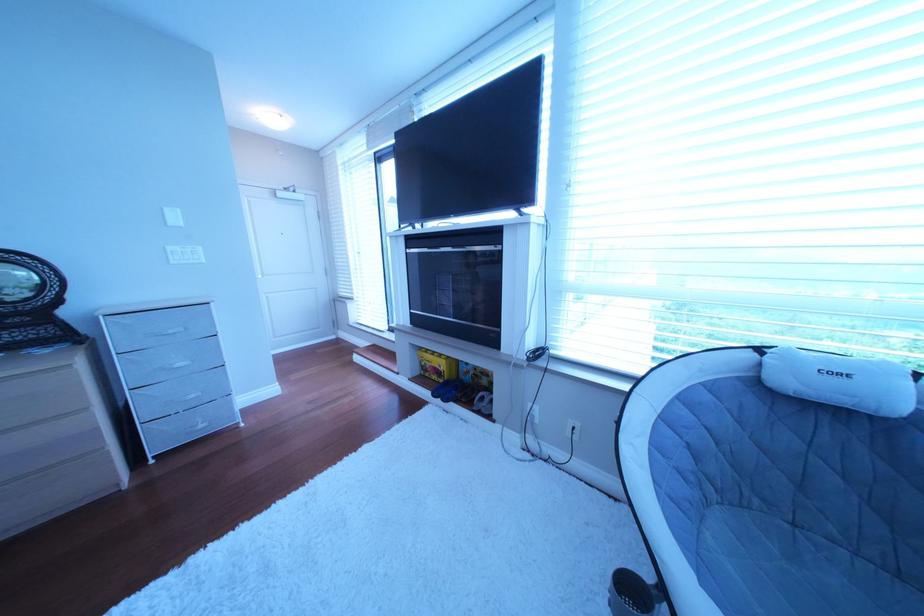
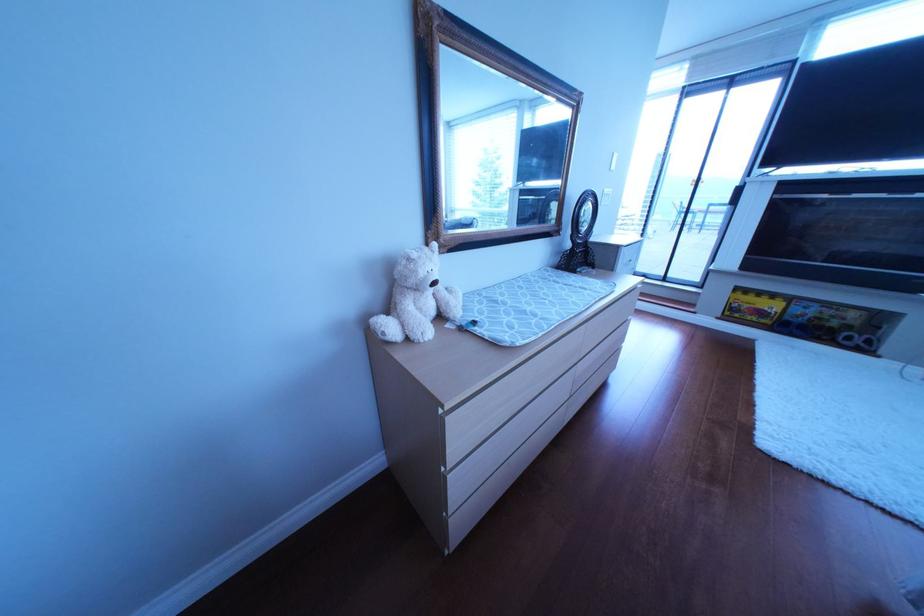
The point at (79,309) is marked in the first image. Where is the corresponding point in the second image?

(605, 240)